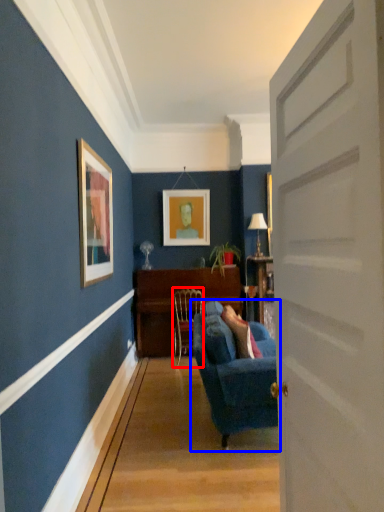
Question: Among these objects, which one is farthest to the camera, chair (highlighted by a red box) or studio couch (highlighted by a blue box)?

Choices:
 (A) chair
 (B) studio couch

Answer: (A)